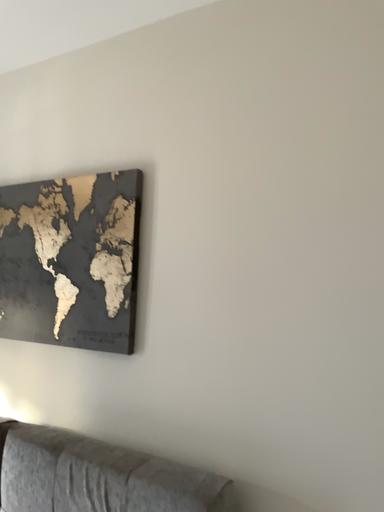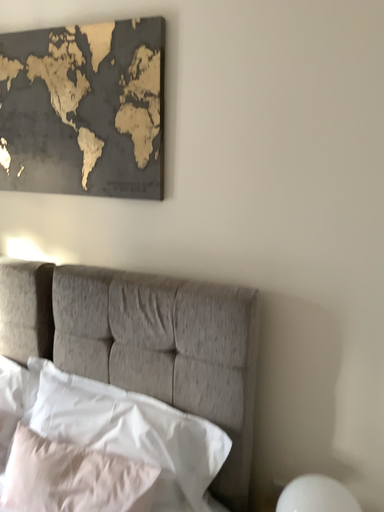
Question: Which way did the camera rotate in the video?

Choices:
 (A) rotated right
 (B) rotated left

Answer: (A)